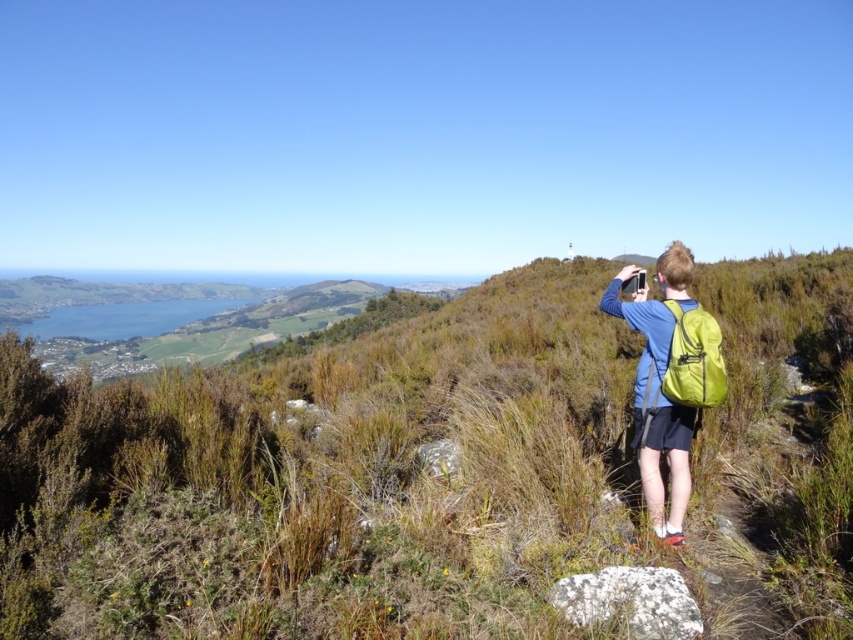
Can you confirm if green grassy at center is taller than green fabric backpack at right?

Indeed, green grassy at center has a greater height compared to green fabric backpack at right.

Does green grassy at center lie behind green fabric backpack at right?

No, green grassy at center is in front of green fabric backpack at right.

Is point (196, 464) in front of point (706, 333)?

No, (196, 464) is behind (706, 333).

Identify the location of green grassy at center. (437, 468).

Can you confirm if blue fabric backpack at right is smaller than green fabric backpack at right?

No, blue fabric backpack at right is not smaller than green fabric backpack at right.

Who is higher up, blue fabric backpack at right or green fabric backpack at right?

Positioned higher is green fabric backpack at right.

Which is behind, point (647, 480) or point (682, 384)?

Point (647, 480)

The image size is (853, 640). Identify the location of blue fabric backpack at right. (659, 387).

Is green grassy at center in front of blue fabric backpack at right?

That is True.

Is point (292, 420) farther from viewer compared to point (672, 285)?

Yes, point (292, 420) is farther from viewer.

Locate an element on the screen. green grassy at center is located at coordinates 437,468.